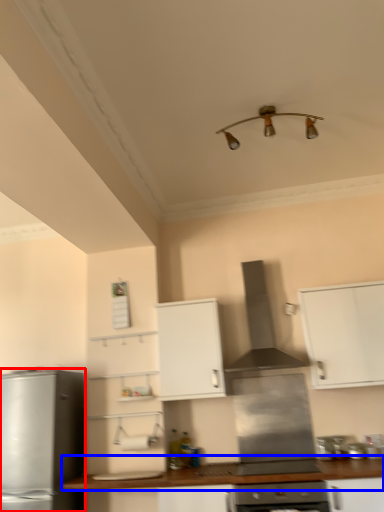
Question: Which object is closer to the camera taking this photo, kitchen appliance (highlighted by a red box) or countertop (highlighted by a blue box)?

Choices:
 (A) kitchen appliance
 (B) countertop

Answer: (B)